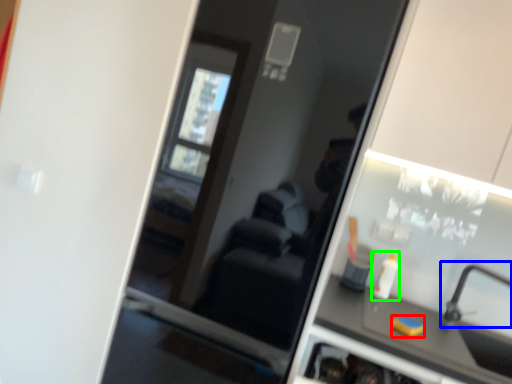
Question: Considering the real-world distances, which object is closest to soap (highlighted by a red box)? faucet (highlighted by a blue box) or toiletry (highlighted by a green box).

Choices:
 (A) faucet
 (B) toiletry

Answer: (B)